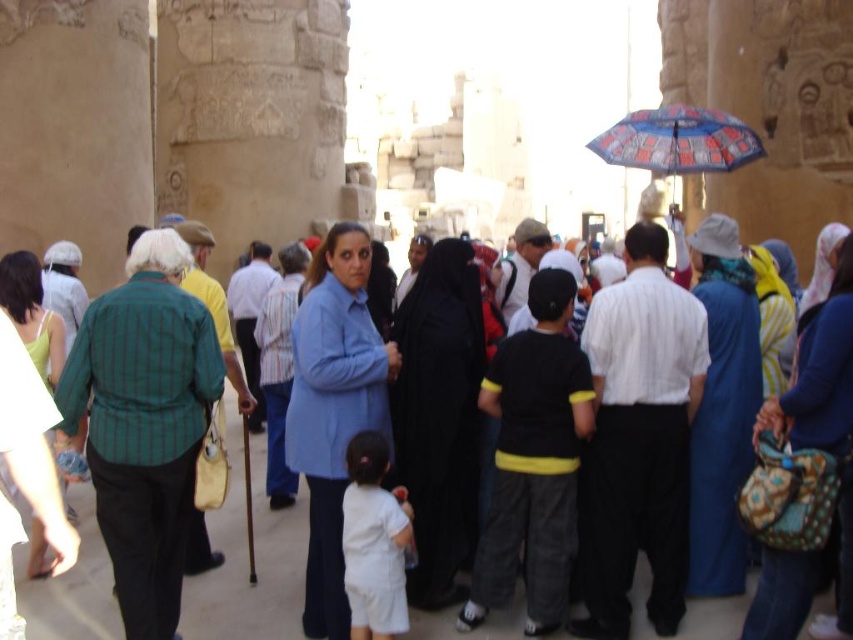
Who is positioned more to the left, black cotton shirt at center or patterned fabric bag at center-right?

black cotton shirt at center

Image resolution: width=853 pixels, height=640 pixels. Identify the location of black cotton shirt at center. (532, 460).

Which is behind, point (474, 618) or point (810, 390)?

Point (474, 618)

Find the location of a particular element. The image size is (853, 640). black cotton shirt at center is located at coordinates (532, 460).

Is white striped shirt at center to the right of blue cotton shirt at center from the viewer's perspective?

Indeed, white striped shirt at center is positioned on the right side of blue cotton shirt at center.

Is white striped shirt at center further to camera compared to blue cotton shirt at center?

No.

Describe the element at coordinates (637, 438) in the screenshot. I see `white striped shirt at center` at that location.

At what (x,y) coordinates should I click in order to perform the action: click on white striped shirt at center. Please return your answer as a coordinate pair (x, y). The height and width of the screenshot is (640, 853). Looking at the image, I should click on (637, 438).

In the scene shown: Is black matte niqab at center smaller than blue fabric dress at center-right?

No, black matte niqab at center is not smaller than blue fabric dress at center-right.

Who is more distant from viewer, (399, 310) or (718, 426)?

Point (399, 310)

Find the location of a particular element. Image resolution: width=853 pixels, height=640 pixels. black matte niqab at center is located at coordinates (439, 417).

This screenshot has height=640, width=853. Identify the location of black matte niqab at center. click(x=439, y=417).